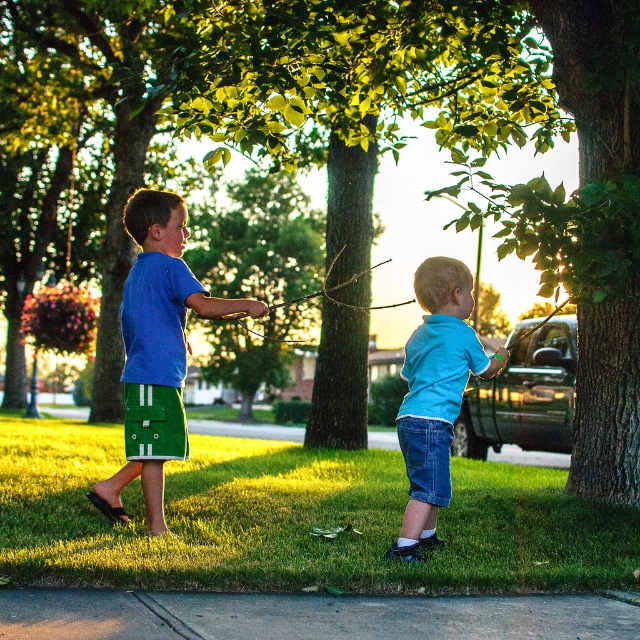
Who is shorter, matte blue t-shirt at center or blue denim shorts at lower center?

Standing shorter between the two is blue denim shorts at lower center.

Is point (145, 467) farther from viewer compared to point (438, 326)?

That is True.

You are a GUI agent. You are given a task and a screenshot of the screen. Output one action in this format:
    pyautogui.click(x=<x>, y=<y>)
    Task: Click on the matte blue t-shirt at center
    This screenshot has width=640, height=640.
    Given the screenshot: What is the action you would take?
    pyautogui.click(x=154, y=349)

Is green grass at lower center bigger than smooth skin hand at center?

Indeed, green grass at lower center has a larger size compared to smooth skin hand at center.

Who is more forward, (x=451, y=557) or (x=244, y=310)?

Positioned in front is point (x=451, y=557).

I want to click on green grass at lower center, so click(x=292, y=518).

Who is shorter, smooth asphalt sidewalk at lower center or matte blue t-shirt at center?

Standing shorter between the two is smooth asphalt sidewalk at lower center.

Which is behind, point (500, 618) or point (163, 513)?

Positioned behind is point (163, 513).

Locate an element on the screen. The width and height of the screenshot is (640, 640). smooth asphalt sidewalk at lower center is located at coordinates (307, 616).

Find the location of a particular element. This screenshot has height=640, width=640. smooth asphalt sidewalk at lower center is located at coordinates (307, 616).